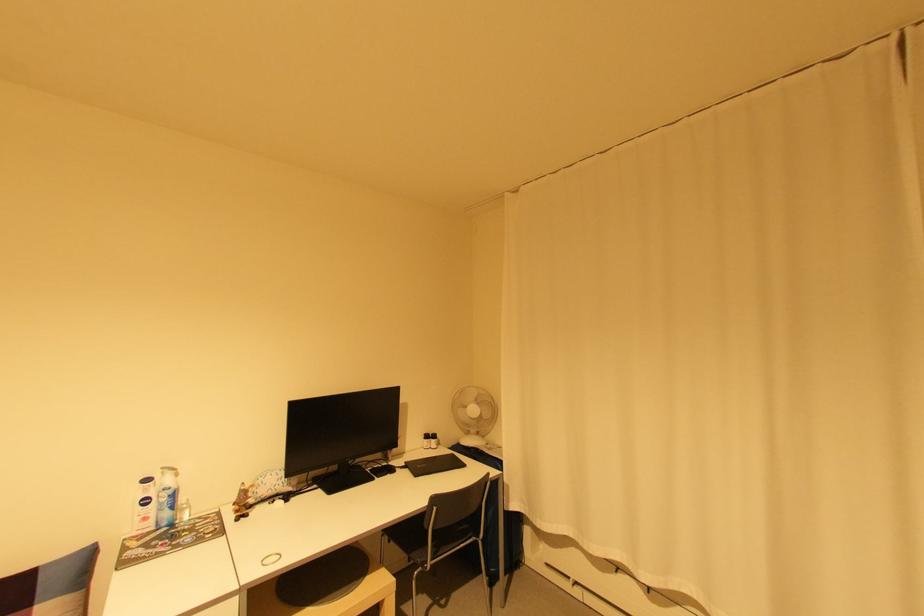
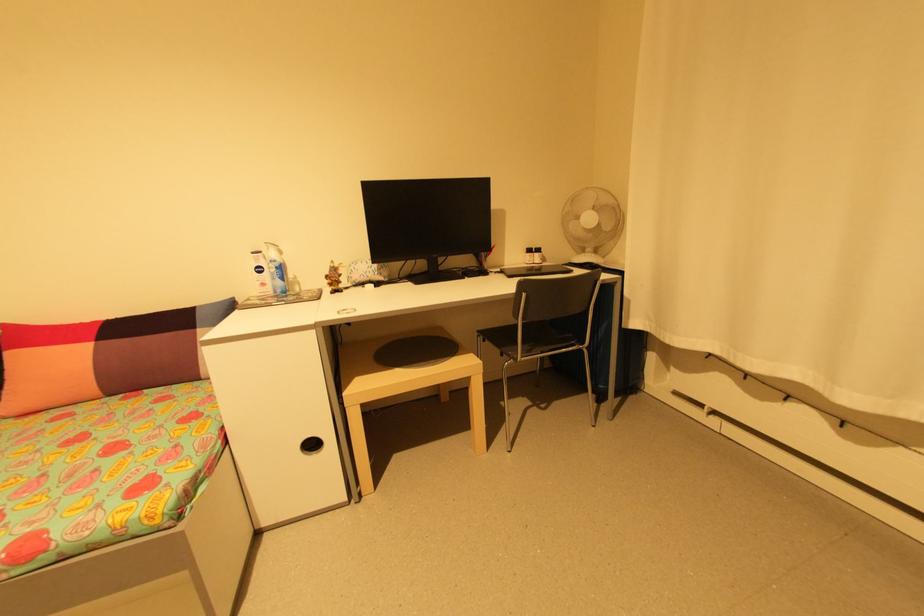
In the second image, find the point that corresponds to (438,440) in the first image.

(541, 254)